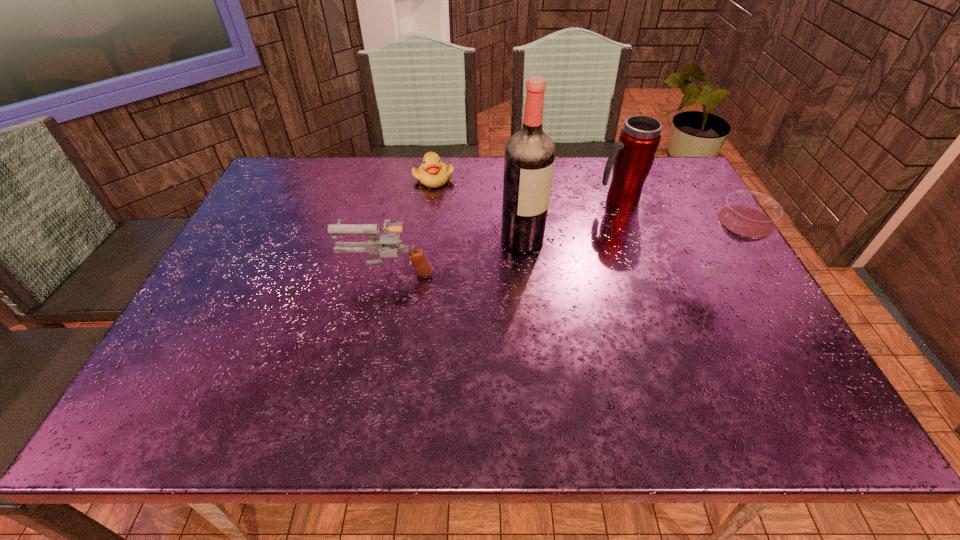
Where is `free space located 0.220m at the barrel end of the fourth tallest object`? The width and height of the screenshot is (960, 540). free space located 0.220m at the barrel end of the fourth tallest object is located at coordinates (257, 269).

I want to click on free space located 0.090m at the barrel end of the fourth tallest object, so click(x=309, y=269).

Find the location of a particular element. The image size is (960, 540). vacant area situated on the left of the rightmost object is located at coordinates (575, 273).

This screenshot has width=960, height=540. I want to click on free space located 0.230m on the front-facing side of the shortest object, so click(482, 229).

Where is `vacant area situated 0.050m on the front-facing side of the shortest object`? vacant area situated 0.050m on the front-facing side of the shortest object is located at coordinates (451, 196).

You are a GUI agent. You are given a task and a screenshot of the screen. Output one action in this format:
    pyautogui.click(x=<x>, y=<y>)
    Task: Click on the vacant space positioned on the front-facing side of the shortest object
    
    Given the screenshot: What is the action you would take?
    pyautogui.click(x=508, y=256)

Where is `free space located on the front-facing side of the tallest object`? This screenshot has width=960, height=540. free space located on the front-facing side of the tallest object is located at coordinates [x=650, y=298].

I want to click on free spot located 0.060m on the front-facing side of the tallest object, so click(561, 257).

I want to click on vacant space located 0.140m on the front-facing side of the tallest object, so click(x=588, y=270).

This screenshot has width=960, height=540. What are the coordinates of `free region located 0.090m on the side with the handle of the fourth shortest object` in the screenshot? It's located at (599, 227).